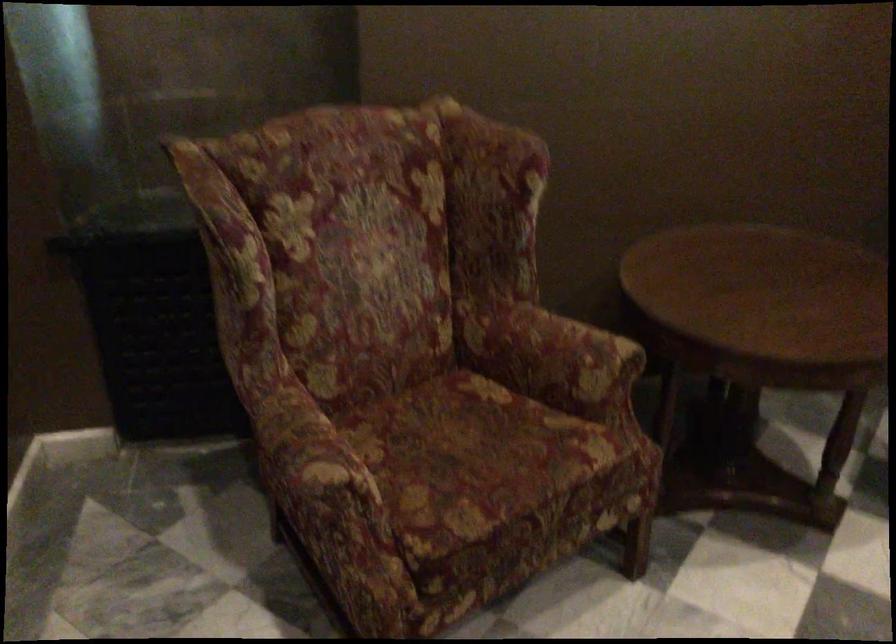
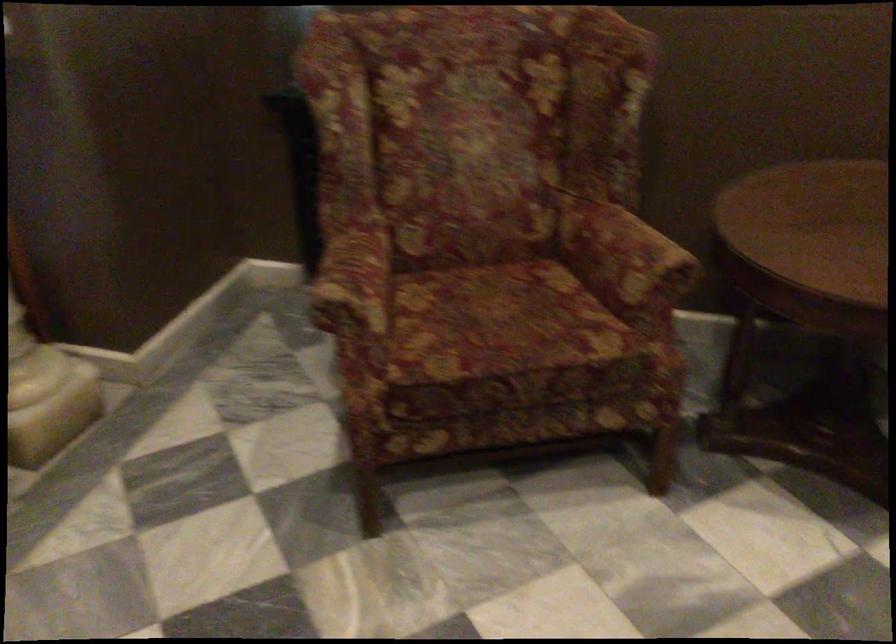
Question: What movement of the cameraman would produce the second image?

Choices:
 (A) Left
 (B) Right
 (C) Forward
 (D) Backward

Answer: (B)